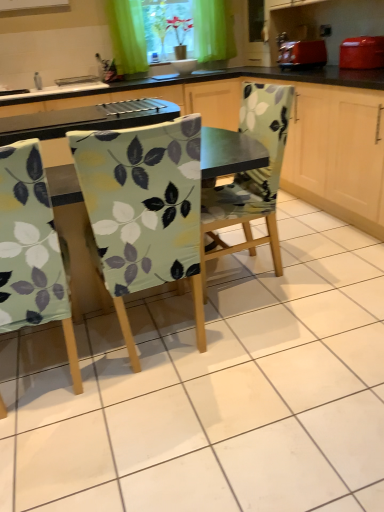
Question: From the image's perspective, is green fabric at upper center located above or below white glossy bowl at upper center, the 2th sink in the left-to-right sequence?

Choices:
 (A) below
 (B) above

Answer: (B)

Question: Considering the positions of green fabric at upper center and white glossy bowl at upper center, which is the 2th sink from bottom to top, in the image, is green fabric at upper center bigger or smaller than white glossy bowl at upper center, which is the 2th sink from bottom to top,?

Choices:
 (A) small
 (B) big

Answer: (B)

Question: Considering the real-world distances, which object is closest to the green fabric at upper center?

Choices:
 (A) matte red toaster at upper right
 (B) light green fabric chair at left, which appears as the first chair when viewed from the left
 (C) light green fabric-covered chair at center, which appears as the second chair when viewed from the right
 (D) matte red toaster at upper right
 (E) floral fabric chair at center, acting as the third chair starting from the left

Answer: (D)

Question: Considering the real-world distances, which object is farthest from the white glossy bowl at upper center, marked as the first sink in a top-to-bottom arrangement?

Choices:
 (A) green fabric at upper center
 (B) light green fabric-covered chair at center, which appears as the second chair when viewed from the right
 (C) matte red toaster at upper right
 (D) white glossy sink at upper left, the second sink in the right-to-left sequence
 (E) floral fabric chair at center, the first chair viewed from the right

Answer: (B)